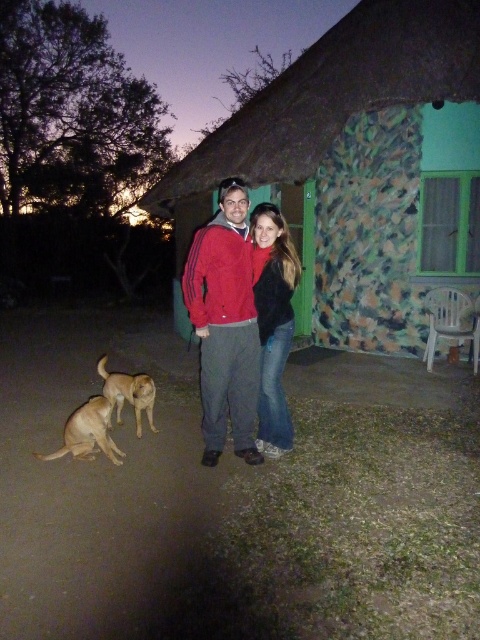
Question: Which object appears farthest from the camera in this image?

Choices:
 (A) brown furry dog at lower left
 (B) golden fur dog at lower left
 (C) camouflage stucco hut at center
 (D) red matte jacket at center

Answer: (C)

Question: Can you confirm if matte black jacket at center is positioned to the left of golden fur dog at lower left?

Choices:
 (A) yes
 (B) no

Answer: (B)

Question: Is camouflage stucco hut at center in front of red matte jacket at center?

Choices:
 (A) yes
 (B) no

Answer: (B)

Question: Is red matte jacket at center above brown furry dog at lower left?

Choices:
 (A) no
 (B) yes

Answer: (B)

Question: Which of the following is the farthest from the observer?

Choices:
 (A) (256, 436)
 (B) (256, 330)

Answer: (A)

Question: Which of the following is the farthest from the observer?

Choices:
 (A) matte black jacket at center
 (B) brown furry dog at lower left
 (C) red matte jacket at center
 (D) golden fur dog at lower left

Answer: (D)